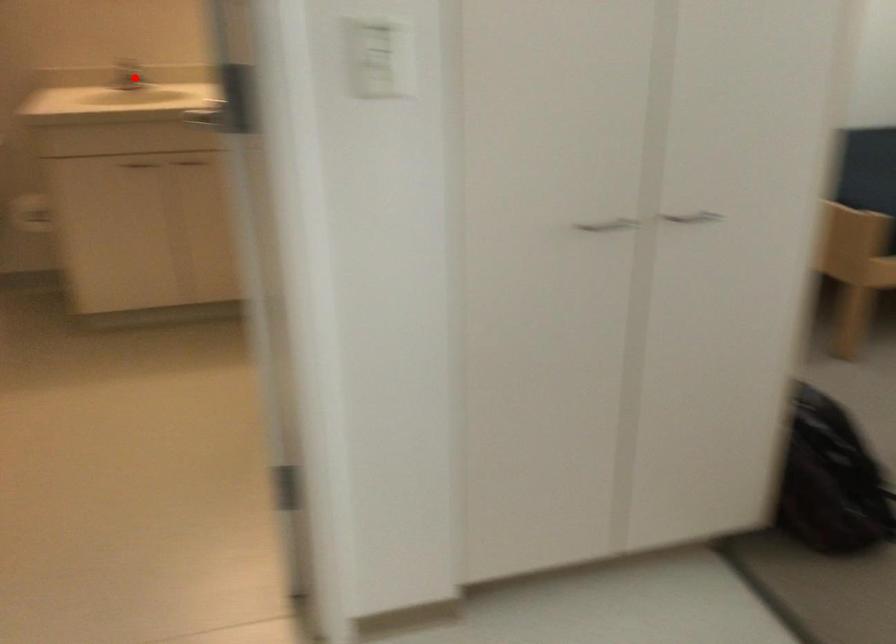
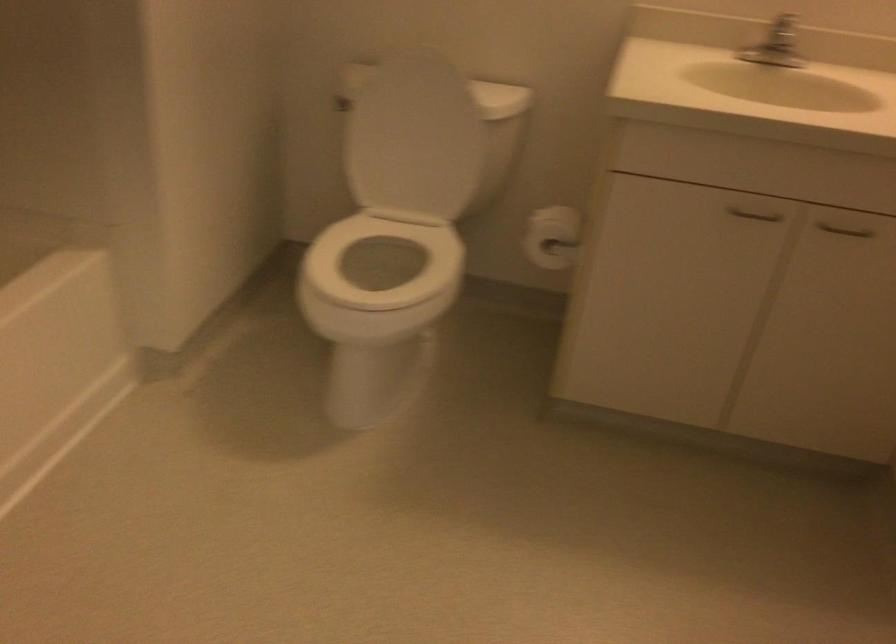
Question: I am providing you with two images of the same scene from different viewpoints. Image1 has a red point marked. In image2, the corresponding 3D location appears at what relative position? Reply with the corresponding letter.

Choices:
 (A) Closer
 (B) Farther

Answer: (A)